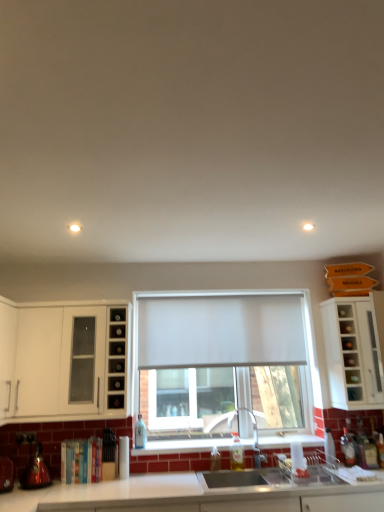
Identify the location of white matte curtain at center. The image size is (384, 512). (220, 331).

What do you see at coordinates (220, 331) in the screenshot? Image resolution: width=384 pixels, height=512 pixels. I see `white matte curtain at center` at bounding box center [220, 331].

What is the approximate width of white glossy countertop at lower center?

24.53 inches.

Find the location of a particular element. white matte window sill at center is located at coordinates (181, 446).

I want to click on white matte curtain at center, so click(220, 331).

Who is bigger, white glossy cabinet at right, placed as the 2th cabinetry when sorted from left to right, or white matte window at center?

Bigger between the two is white glossy cabinet at right, placed as the 2th cabinetry when sorted from left to right.

From a real-world perspective, who is located higher, white glossy cabinet at right, placed as the 2th cabinetry when sorted from left to right, or white matte window at center?

white glossy cabinet at right, placed as the 2th cabinetry when sorted from left to right, is physically above.

Which object is thinner, white glossy cabinet at right, arranged as the 1th cabinetry when viewed from the right, or white matte window at center?

white matte window at center.

Is white glossy cabinet at right, placed as the 2th cabinetry when sorted from left to right, to the left or to the right of white matte window at center in the image?

Clearly, white glossy cabinet at right, placed as the 2th cabinetry when sorted from left to right, is on the right of white matte window at center in the image.

Considering the relative sizes of white glossy cabinet at right, arranged as the 1th cabinetry when viewed from the right, and matte stainless steel sink at lower center in the image provided, is white glossy cabinet at right, arranged as the 1th cabinetry when viewed from the right, taller than matte stainless steel sink at lower center?

Yes, white glossy cabinet at right, arranged as the 1th cabinetry when viewed from the right, is taller than matte stainless steel sink at lower center.

Between white glossy cabinet at right, arranged as the 1th cabinetry when viewed from the right, and matte stainless steel sink at lower center, which one has larger size?

Bigger between the two is matte stainless steel sink at lower center.

Which object is closer to the camera, white glossy cabinet at right, placed as the 2th cabinetry when sorted from left to right, or matte stainless steel sink at lower center?

matte stainless steel sink at lower center is closer to the camera.

Where is `the 2nd cabinetry behind the matte stainless steel sink at lower center, counting from the anchor's position`? The height and width of the screenshot is (512, 384). the 2nd cabinetry behind the matte stainless steel sink at lower center, counting from the anchor's position is located at coordinates (352, 352).

From the image's perspective, is satin nickel faucet at sink center located above or below translucent glass bottle at lower right, arranged as the 1th bottle when viewed from the right?

satin nickel faucet at sink center is situated higher than translucent glass bottle at lower right, arranged as the 1th bottle when viewed from the right, in the image.

Is satin nickel faucet at sink center facing towards translucent glass bottle at lower right, which appears as the sixth bottle when viewed from the left?

No.

From a real-world perspective, relative to translucent glass bottle at lower right, arranged as the 1th bottle when viewed from the right, is satin nickel faucet at sink center vertically above or below?

satin nickel faucet at sink center is situated higher than translucent glass bottle at lower right, arranged as the 1th bottle when viewed from the right, in the real world.

Find the location of a particular element. The image size is (384, 512). faucet lying above the translucent glass bottle at lower right, which appears as the sixth bottle when viewed from the left (from the image's perspective) is located at coordinates (253, 434).

Between white glossy cabinet at right, placed as the 2th cabinetry when sorted from left to right, and translucent glass bottle at lower right, the fifth bottle positioned from the left, which one has more height?

Standing taller between the two is white glossy cabinet at right, placed as the 2th cabinetry when sorted from left to right.

Would you say white glossy cabinet at right, placed as the 2th cabinetry when sorted from left to right, is outside translucent glass bottle at lower right, the fifth bottle positioned from the left?

Yes, white glossy cabinet at right, placed as the 2th cabinetry when sorted from left to right, is located beyond the bounds of translucent glass bottle at lower right, the fifth bottle positioned from the left.

From the image's perspective, which object appears higher, white glossy cabinet at right, placed as the 2th cabinetry when sorted from left to right, or translucent glass bottle at lower right, the second bottle in the right-to-left sequence?

Answer: white glossy cabinet at right, placed as the 2th cabinetry when sorted from left to right, appears higher in the image.

Is white glossy cabinet at right, arranged as the 1th cabinetry when viewed from the right, to the right of translucent glass bottle at lower right, the fifth bottle positioned from the left, from the viewer's perspective?

Indeed, white glossy cabinet at right, arranged as the 1th cabinetry when viewed from the right, is positioned on the right side of translucent glass bottle at lower right, the fifth bottle positioned from the left.

Consider the image. Between clear glass bottle at center, which ranks as the first bottle in left-to-right order, and clear glass bottle at sink, acting as the 3th bottle starting from the left, which one appears on the right side from the viewer's perspective?

clear glass bottle at sink, acting as the 3th bottle starting from the left, is more to the right.

Is clear glass bottle at sink, acting as the 3th bottle starting from the left, at the back of clear glass bottle at center, which is counted as the 6th bottle, starting from the right?

No.

From the image's perspective, is clear glass bottle at center, which is counted as the 6th bottle, starting from the right, beneath clear glass bottle at sink, arranged as the 4th bottle when viewed from the right?

No, from the image's perspective, clear glass bottle at center, which is counted as the 6th bottle, starting from the right, is not below clear glass bottle at sink, arranged as the 4th bottle when viewed from the right.

Would you consider clear glass bottle at sink, acting as the 3th bottle starting from the left, to be distant from white matte window sill at center?

No, there isn't a large distance between clear glass bottle at sink, acting as the 3th bottle starting from the left, and white matte window sill at center.

Considering the relative sizes of clear glass bottle at sink, acting as the 3th bottle starting from the left, and white matte window sill at center in the image provided, is clear glass bottle at sink, acting as the 3th bottle starting from the left, shorter than white matte window sill at center?

In fact, clear glass bottle at sink, acting as the 3th bottle starting from the left, may be taller than white matte window sill at center.

Can you confirm if clear glass bottle at sink, acting as the 3th bottle starting from the left, is wider than white matte window sill at center?

No.

Is clear glass bottle at sink, acting as the 3th bottle starting from the left, turned away from white matte window sill at center?

Absolutely, clear glass bottle at sink, acting as the 3th bottle starting from the left, is directed away from white matte window sill at center.

Considering the sizes of objects translucent glass bottle at lower center, the fifth bottle positioned from the right, and white glossy cabinet at left, which is the 1th cabinetry in left-to-right order, in the image provided, who is bigger, translucent glass bottle at lower center, the fifth bottle positioned from the right, or white glossy cabinet at left, which is the 1th cabinetry in left-to-right order,?

white glossy cabinet at left, which is the 1th cabinetry in left-to-right order, is bigger.

From a real-world perspective, count 2nd cabinetrys upward from the translucent glass bottle at lower center, the fifth bottle positioned from the right, and point to it. Please provide its 2D coordinates.

[(63, 360)]

Who is taller, translucent glass bottle at lower center, the 2th bottle viewed from the left, or white glossy cabinet at left, the 2th cabinetry when ordered from right to left?

With more height is white glossy cabinet at left, the 2th cabinetry when ordered from right to left.

The image size is (384, 512). Find the location of `window located underneath the white glossy cabinet at right, arranged as the 1th cabinetry when viewed from the right (from a real-world perspective)`. window located underneath the white glossy cabinet at right, arranged as the 1th cabinetry when viewed from the right (from a real-world perspective) is located at coordinates (224, 333).

I want to click on cabinetry that is the 1st object above the matte stainless steel sink at lower center (from a real-world perspective), so click(352, 352).

Based on their spatial positions, is matte stainless steel sink at lower center or clear glass bottle at sink, arranged as the 4th bottle when viewed from the right, closer to white matte curtain at center?

clear glass bottle at sink, arranged as the 4th bottle when viewed from the right, lies closer to white matte curtain at center than the other object.

From the image, which object appears to be nearer to clear glass bottle at center, which is counted as the 6th bottle, starting from the right, matte glass shelf at lower left or white glossy cabinet at right, placed as the 2th cabinetry when sorted from left to right?

Among the two, matte glass shelf at lower left is located nearer to clear glass bottle at center, which is counted as the 6th bottle, starting from the right.

Which object lies further to the anchor point shiny metallic kettle at lower left, the second appliance viewed from the left, matte glass shelf at lower left or white glossy cabinet at left, the 2th cabinetry when ordered from right to left?

matte glass shelf at lower left lies further to shiny metallic kettle at lower left, the second appliance viewed from the left, than the other object.

Which object lies further to the anchor point shiny metallic kettle at lower left, the second appliance viewed from the left, translucent glass bottle at lower right, which appears as the sixth bottle when viewed from the left, or white glossy countertop at lower center?

translucent glass bottle at lower right, which appears as the sixth bottle when viewed from the left, is positioned further to the anchor shiny metallic kettle at lower left, the second appliance viewed from the left.

From the image, which object appears to be nearer to metallic red kettle at lower left, the second appliance when ordered from right to left, clear glass bottle at center, which ranks as the first bottle in left-to-right order, or matte glass shelf at lower left?

Based on the image, matte glass shelf at lower left appears to be nearer to metallic red kettle at lower left, the second appliance when ordered from right to left.

Estimate the real-world distances between objects in this image. Which object is closer to matte glass shelf at lower left, clear glass bottle at sink, arranged as the 4th bottle when viewed from the right, or white matte window sill at center?

Among the two, white matte window sill at center is located nearer to matte glass shelf at lower left.

Looking at the image, which one is located closer to white matte window sill at center, translucent glass bottle at lower right, the second bottle in the right-to-left sequence, or translucent glass bottle at lower center, the 2th bottle viewed from the left?

translucent glass bottle at lower center, the 2th bottle viewed from the left, is positioned closer to the anchor white matte window sill at center.

Considering their positions, is clear glass bottle at sink, acting as the 3th bottle starting from the left, positioned further to white matte curtain at center than clear glass bottle at lower right, which is the 3th bottle from right to left?

clear glass bottle at lower right, which is the 3th bottle from right to left, is further to white matte curtain at center.

You are a GUI agent. You are given a task and a screenshot of the screen. Output one action in this format:
    pyautogui.click(x=<x>, y=<y>)
    Task: Click on the faucet located between white matte window sill at center and clear glass bottle at lower right, the fourth bottle positioned from the left, in the left-right direction
    The height and width of the screenshot is (512, 384).
    Given the screenshot: What is the action you would take?
    pyautogui.click(x=253, y=434)

In order to click on window sill between white glossy cabinet at left, which is the 1th cabinetry in left-to-right order, and clear glass bottle at lower right, the fourth bottle positioned from the left, from left to right in this screenshot , I will do `click(181, 446)`.

Identify the location of countertop between white glossy cabinet at left, which is the 1th cabinetry in left-to-right order, and white glossy cabinet at right, placed as the 2th cabinetry when sorted from left to right, from left to right. (195, 496).

At what (x,y) coordinates should I click in order to perform the action: click on cabinetry between metallic red kettle at lower left, the second appliance when ordered from right to left, and white glossy cabinet at right, placed as the 2th cabinetry when sorted from left to right, in the horizontal direction. Please return your answer as a coordinate pair (x, y). The image size is (384, 512). Looking at the image, I should click on (63, 360).